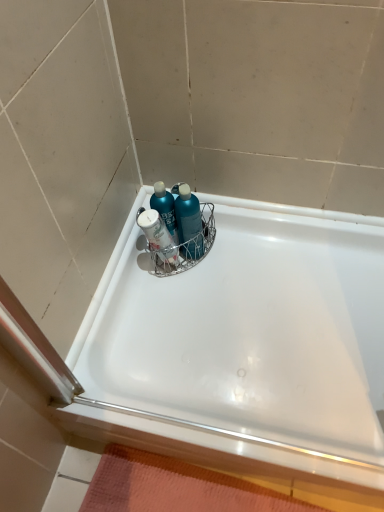
Question: Can you confirm if orange textured bath mat at bottom is wider than teal glossy bottle at center?

Choices:
 (A) yes
 (B) no

Answer: (A)

Question: From the image's perspective, would you say orange textured bath mat at bottom is positioned over teal glossy bottle at center?

Choices:
 (A) no
 (B) yes

Answer: (A)

Question: Considering the relative positions of orange textured bath mat at bottom and teal glossy bottle at center in the image provided, is orange textured bath mat at bottom to the left of teal glossy bottle at center from the viewer's perspective?

Choices:
 (A) no
 (B) yes

Answer: (A)

Question: Is orange textured bath mat at bottom closer to camera compared to teal glossy bottle at center?

Choices:
 (A) yes
 (B) no

Answer: (A)

Question: Does orange textured bath mat at bottom have a lesser height compared to teal glossy bottle at center?

Choices:
 (A) yes
 (B) no

Answer: (A)

Question: Looking at the image, does teal plastic bottles at center, placed as the 1th cleaning product when sorted from right to left, seem bigger or smaller compared to white glossy ledge at lower right?

Choices:
 (A) small
 (B) big

Answer: (A)

Question: From the image's perspective, is teal plastic bottles at center, placed as the 1th cleaning product when sorted from right to left, located above or below white glossy ledge at lower right?

Choices:
 (A) below
 (B) above

Answer: (B)

Question: Considering the relative positions of teal plastic bottles at center, placed as the 1th cleaning product when sorted from right to left, and white glossy ledge at lower right in the image provided, is teal plastic bottles at center, placed as the 1th cleaning product when sorted from right to left, to the left or to the right of white glossy ledge at lower right?

Choices:
 (A) left
 (B) right

Answer: (A)

Question: Is teal plastic bottles at center, the 2th cleaning product viewed from the left, situated inside white glossy ledge at lower right or outside?

Choices:
 (A) outside
 (B) inside

Answer: (A)

Question: Considering the positions of teal plastic bottles at center, the 2th cleaning product viewed from the left, and teal glossy shampoo at center, which is the first cleaning product from left to right, in the image, is teal plastic bottles at center, the 2th cleaning product viewed from the left, bigger or smaller than teal glossy shampoo at center, which is the first cleaning product from left to right,?

Choices:
 (A) small
 (B) big

Answer: (B)

Question: From the image's perspective, is teal plastic bottles at center, the 2th cleaning product viewed from the left, positioned above or below teal glossy shampoo at center, which is the first cleaning product from left to right?

Choices:
 (A) below
 (B) above

Answer: (B)

Question: Is point (193, 202) closer or farther from the camera than point (150, 203)?

Choices:
 (A) closer
 (B) farther

Answer: (B)

Question: Looking at their shapes, would you say teal plastic bottles at center, the 2th cleaning product viewed from the left, is wider or thinner than teal glossy shampoo at center, placed as the 2th cleaning product when sorted from right to left?

Choices:
 (A) thin
 (B) wide

Answer: (B)

Question: Looking at the image, does white glossy ledge at lower right seem bigger or smaller compared to teal glossy bottle at center?

Choices:
 (A) big
 (B) small

Answer: (A)

Question: Considering the positions of white glossy ledge at lower right and teal glossy bottle at center in the image, is white glossy ledge at lower right wider or thinner than teal glossy bottle at center?

Choices:
 (A) thin
 (B) wide

Answer: (A)